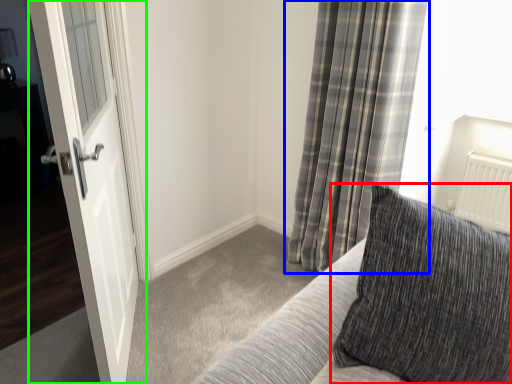
Question: Which is farther away from pillow (highlighted by a red box)? curtain (highlighted by a blue box) or door (highlighted by a green box)?

Choices:
 (A) curtain
 (B) door

Answer: (A)